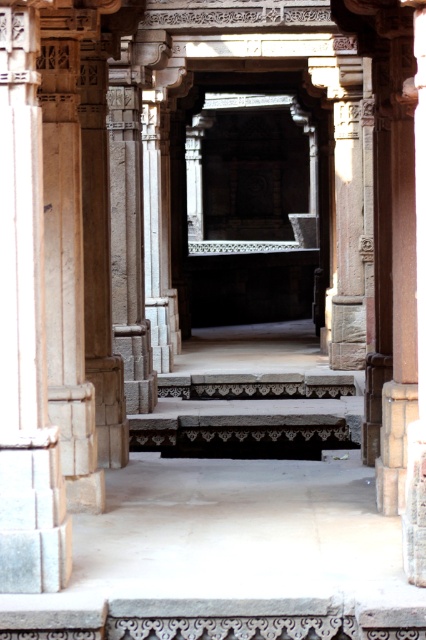
Between gray stone pillar at left and dark gray stone stairs at center, which one is positioned lower?

dark gray stone stairs at center is below.

Is point (42, 378) positioned in front of point (252, 452)?

Yes, point (42, 378) is closer to viewer.

Is point (23, 252) positioned in front of point (333, 420)?

Yes, it is.

Locate an element on the screen. The image size is (426, 640). gray stone pillar at left is located at coordinates (25, 328).